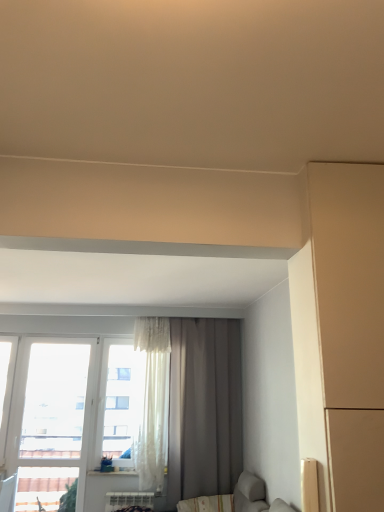
Question: Is transparent glass window at left situated inside gray matte curtain at center or outside?

Choices:
 (A) inside
 (B) outside

Answer: (B)

Question: Looking at their shapes, would you say transparent glass window at left is wider or thinner than gray matte curtain at center?

Choices:
 (A) wide
 (B) thin

Answer: (B)

Question: From a real-world perspective, is transparent glass window at left physically located above or below gray matte curtain at center?

Choices:
 (A) below
 (B) above

Answer: (A)

Question: Would you say gray matte curtain at center is inside or outside transparent glass window at left?

Choices:
 (A) outside
 (B) inside

Answer: (A)

Question: In terms of size, does gray matte curtain at center appear bigger or smaller than transparent glass window at left?

Choices:
 (A) small
 (B) big

Answer: (B)

Question: From a real-world perspective, is gray matte curtain at center above or below transparent glass window at left?

Choices:
 (A) above
 (B) below

Answer: (A)

Question: From the image's perspective, is gray matte curtain at center positioned above or below transparent glass window at left?

Choices:
 (A) below
 (B) above

Answer: (B)